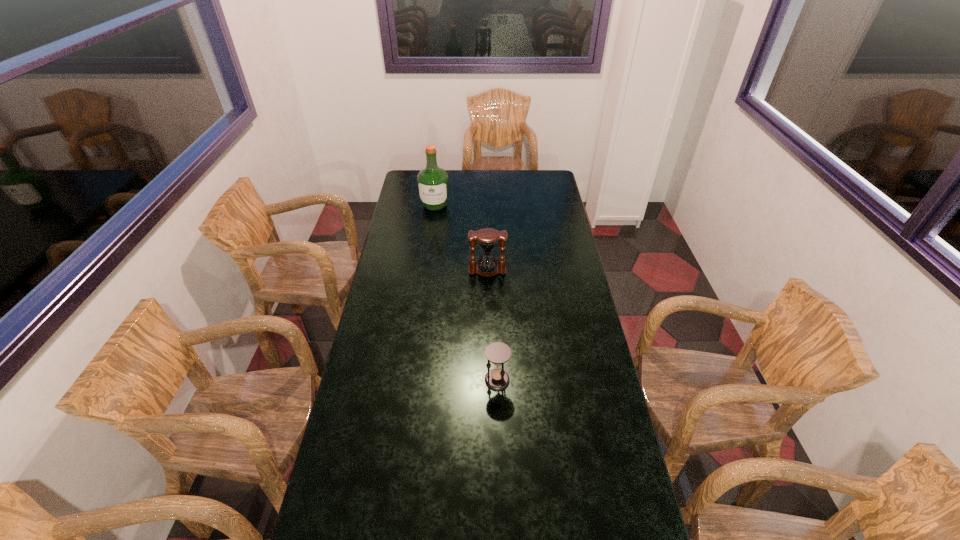
The image size is (960, 540). I want to click on the leftmost object, so click(x=433, y=182).

Identify the location of the farthest object. The height and width of the screenshot is (540, 960). (433, 182).

Find the location of a particular element. The image size is (960, 540). the farther hourglass is located at coordinates (487, 239).

The image size is (960, 540). I want to click on the second tallest object, so click(x=487, y=239).

The width and height of the screenshot is (960, 540). I want to click on the shorter hourglass, so click(x=498, y=353).

The width and height of the screenshot is (960, 540). I want to click on the nearest object, so click(x=498, y=353).

Find the location of a particular element. vacant space positioned 0.250m on the front-facing side of the farthest object is located at coordinates (429, 245).

Where is `vacant space situated on the right of the taller hourglass`? vacant space situated on the right of the taller hourglass is located at coordinates (524, 271).

Where is `vacant space positioned 0.190m on the back of the shortest object`? The image size is (960, 540). vacant space positioned 0.190m on the back of the shortest object is located at coordinates (495, 328).

Image resolution: width=960 pixels, height=540 pixels. What are the coordinates of `object that is at the left edge` in the screenshot? It's located at (433, 182).